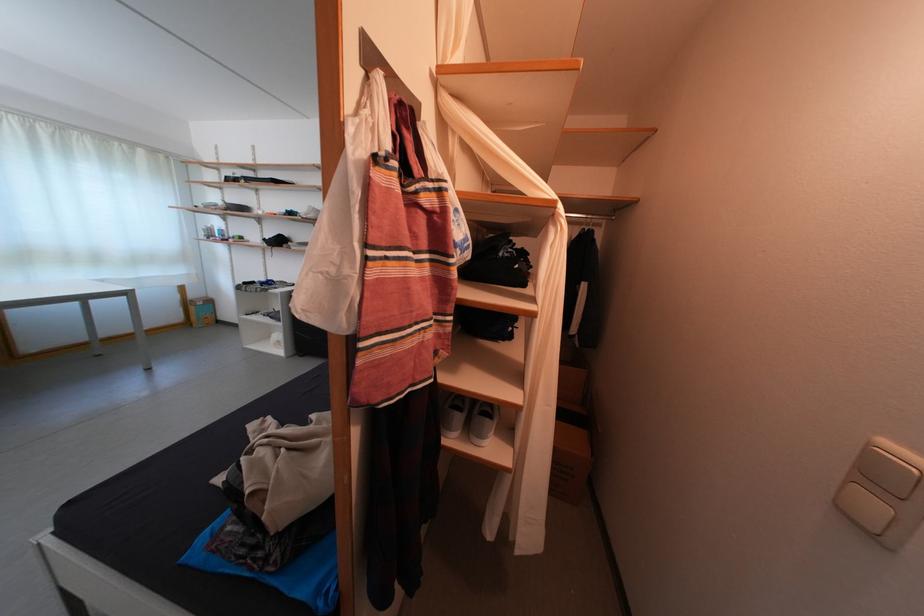
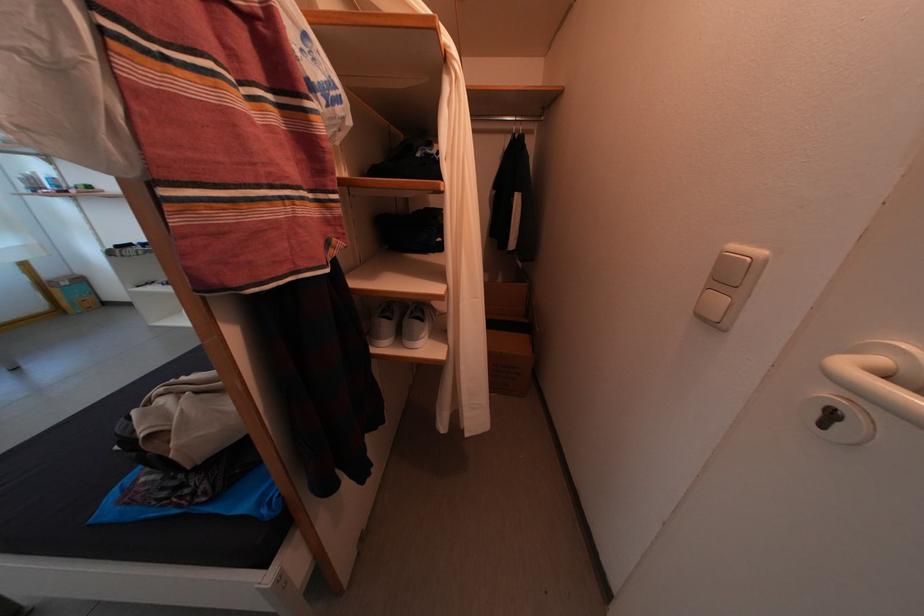
The point at [492,440] is marked in the first image. Where is the corresponding point in the second image?

(423, 344)